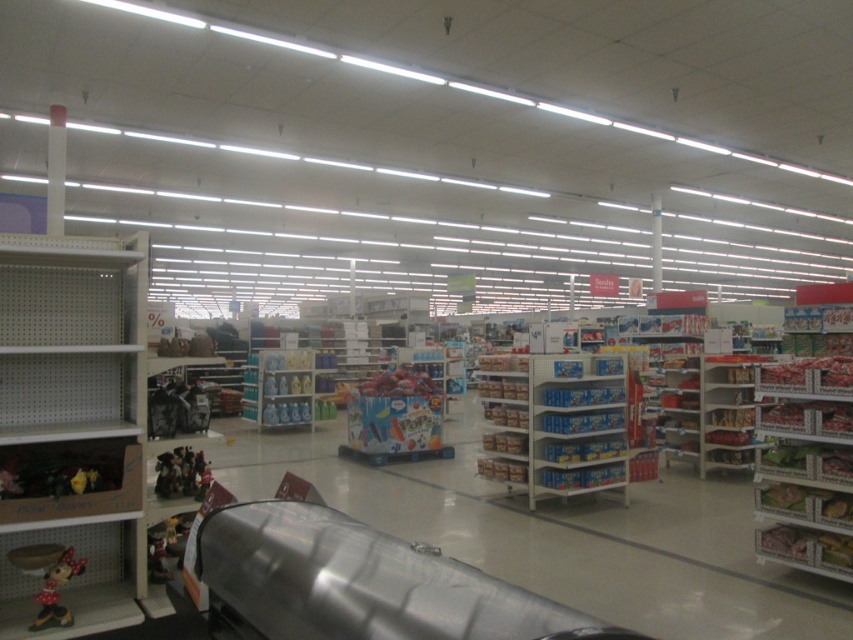
Question: Does white matte shelf at left have a larger size compared to metallic silver shelves at right?

Choices:
 (A) no
 (B) yes

Answer: (A)

Question: Among these objects, which one is nearest to the camera?

Choices:
 (A) matte plastic minnie mouse at lower left
 (B) velvet plush toys at lower left

Answer: (A)

Question: Does white matte shelf at left appear over matte plastic minnie mouse at lower left?

Choices:
 (A) no
 (B) yes

Answer: (B)

Question: Which point is closer to the camera taking this photo?

Choices:
 (A) (42, 609)
 (B) (161, 524)
 (C) (19, 518)

Answer: (C)

Question: Which point is farther from the camera taking this photo?

Choices:
 (A) (724, 420)
 (B) (120, 358)

Answer: (A)

Question: Can you confirm if matte plastic minnie mouse at lower left is smaller than metallic silver toy at lower left?

Choices:
 (A) yes
 (B) no

Answer: (B)